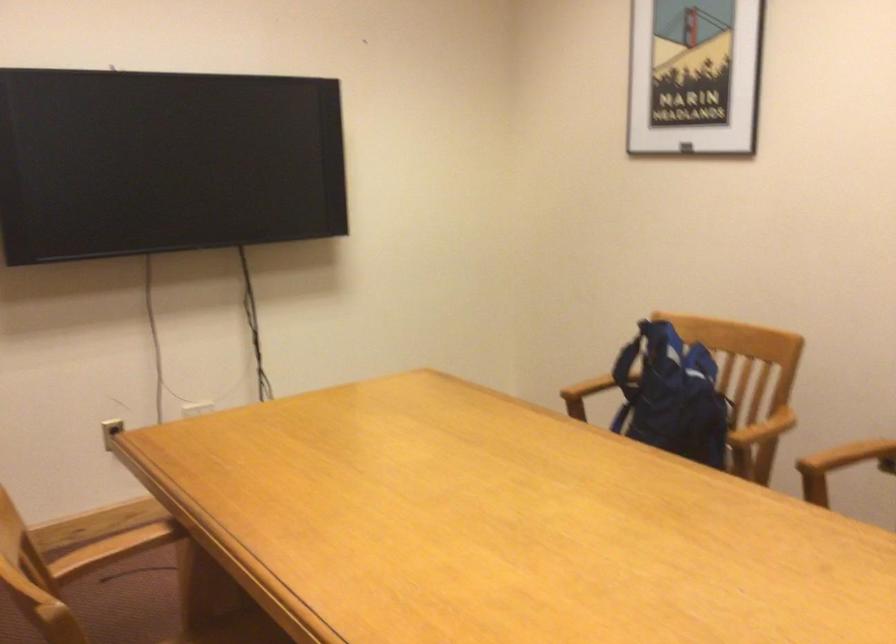
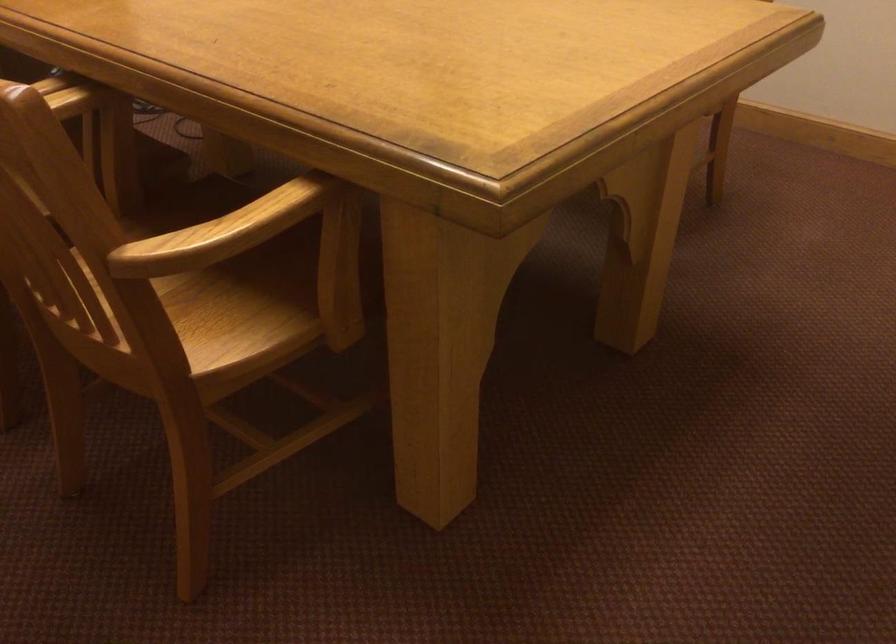
Question: How did the camera likely rotate?

Choices:
 (A) Left
 (B) Right
 (C) Up
 (D) Down

Answer: (D)